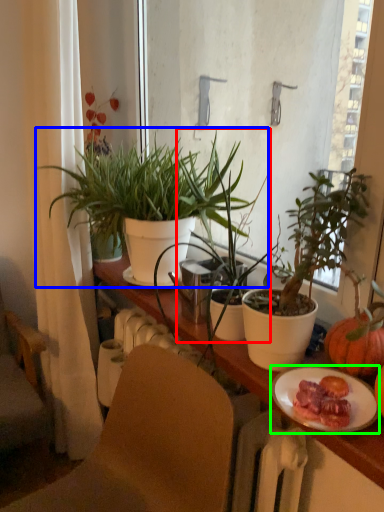
Question: Based on their relative distances, which object is nearer to houseplant (highlighted by a red box)? Choose from houseplant (highlighted by a blue box) and plate (highlighted by a green box).

Choices:
 (A) houseplant
 (B) plate

Answer: (A)